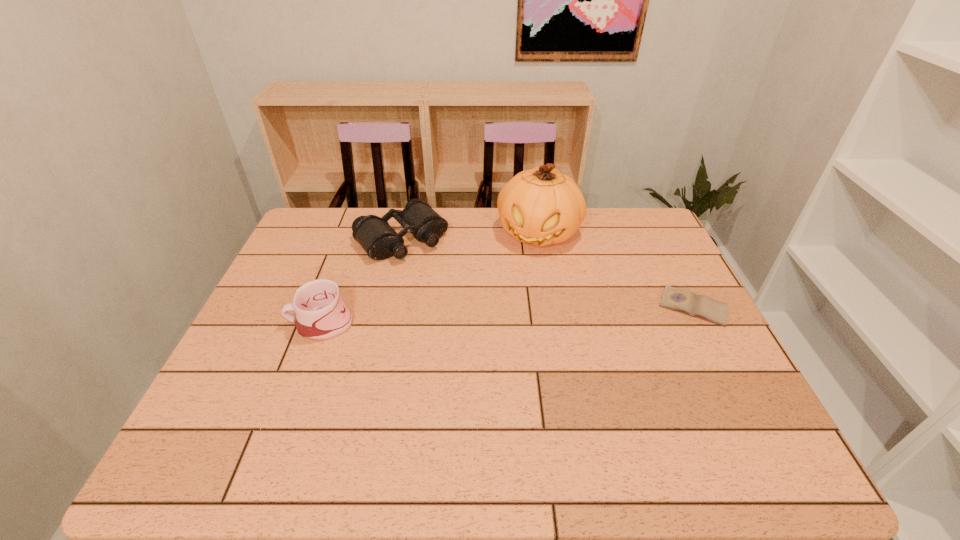
What are the coordinates of `free spot between the second object from right to left and the mug` in the screenshot? It's located at (429, 278).

Where is `vacant space that's between the binoculars and the mug`? The width and height of the screenshot is (960, 540). vacant space that's between the binoculars and the mug is located at coordinates (361, 281).

At what (x,y) coordinates should I click in order to perform the action: click on free space between the mug and the second object from right to left. Please return your answer as a coordinate pair (x, y). Image resolution: width=960 pixels, height=540 pixels. Looking at the image, I should click on (429, 278).

Where is `object that is the second nearest to the binoculars`? This screenshot has width=960, height=540. object that is the second nearest to the binoculars is located at coordinates (321, 314).

Point out which object is positioned as the third nearest to the mug. Please provide its 2D coordinates. Your answer should be formatted as a tuple, i.e. [(x, y)], where the tuple contains the x and y coordinates of a point satisfying the conditions above.

[(686, 301)]

The height and width of the screenshot is (540, 960). I want to click on free space that satisfies the following two spatial constraints: 1. on the front side of the binoculars; 2. on the left side of the diary, so click(386, 307).

Find the location of a particular element. The image size is (960, 540). free location that satisfies the following two spatial constraints: 1. on the front side of the shortest object; 2. on the left side of the third object from left to right is located at coordinates (551, 307).

Find the location of a particular element. The image size is (960, 540). vacant space that satisfies the following two spatial constraints: 1. on the front side of the rightmost object; 2. on the left side of the second object from right to left is located at coordinates [x=551, y=307].